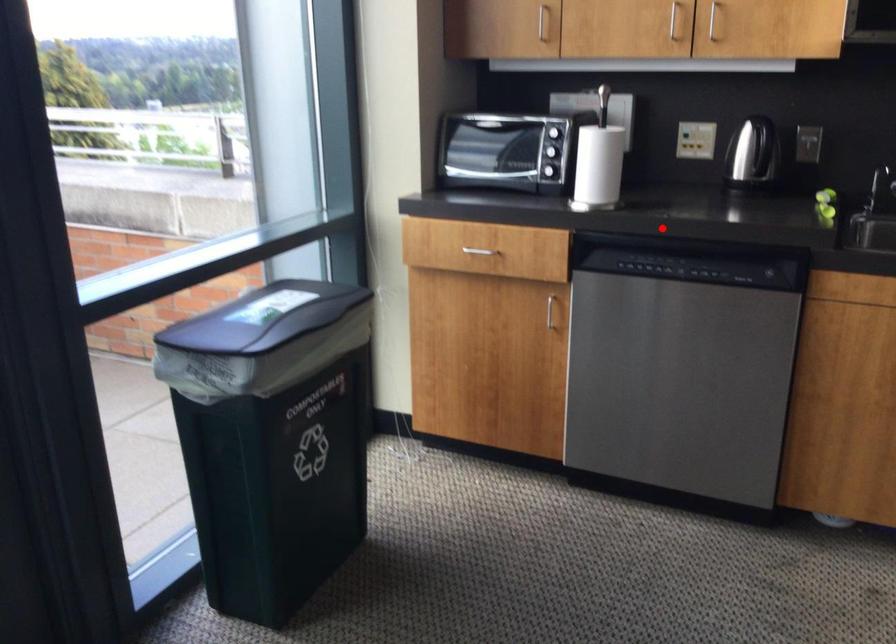
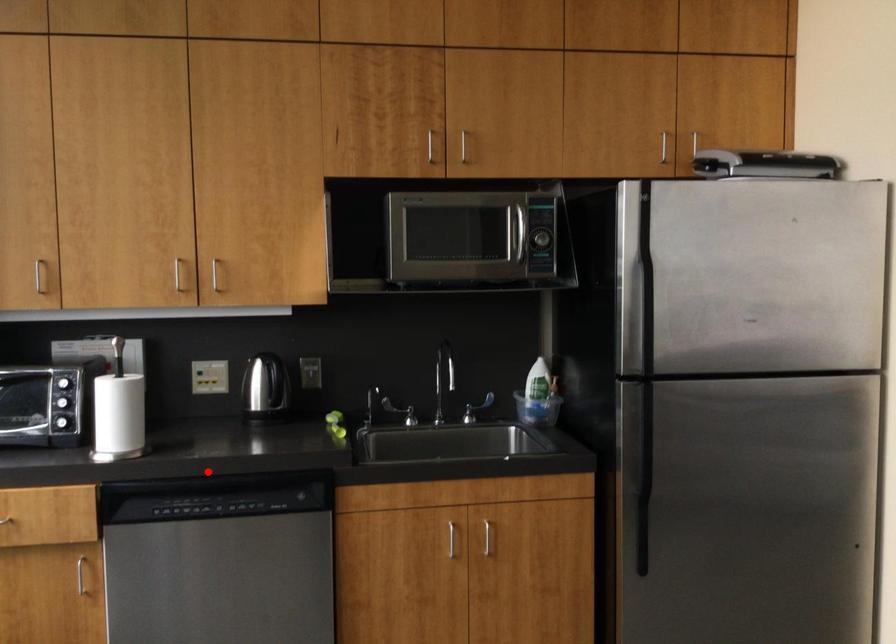
I am providing you with two images of the same scene from different viewpoints. A red point is marked on the first image and another point is marked on the second image. Is the red point in image1 aligned with the point shown in image2?

Yes